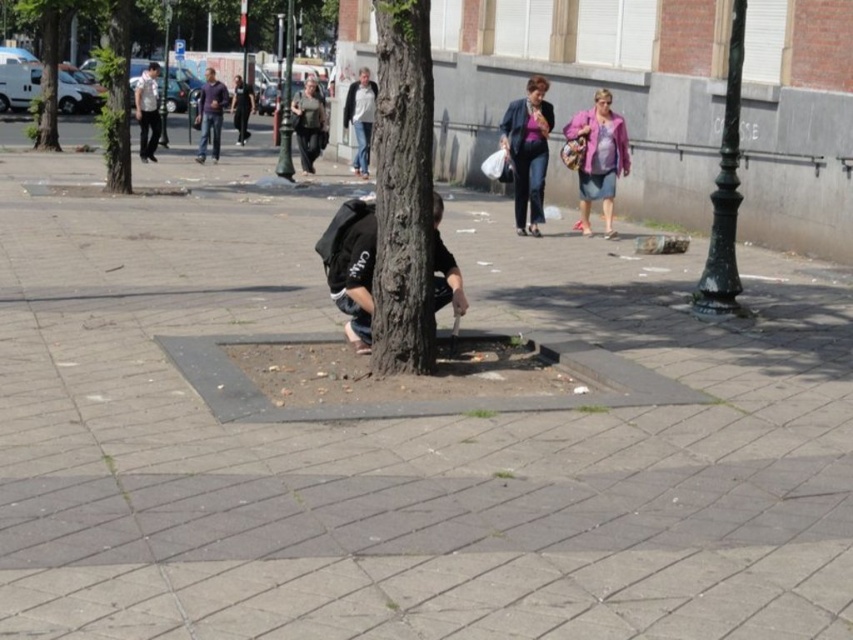
You are a city planner reviewing this public square layout. You notice the dark brown textured tree trunk at center and the dark gray jacket at upper left. Which object occupies more space in the image?

The dark gray jacket at upper left occupies more space in the image because the dark brown textured tree trunk at center is smaller than the dark gray jacket at upper left.

You are a city planner assessing the public square. You need to determine if the dark brown textured tree trunk at center will block the view of the dark gray jacket at upper left for someone standing at the base of the tree. Based on their heights, what do you conclude?

The dark brown textured tree trunk at center is not as tall as the dark gray jacket at upper left, so the tree trunk will not block the view of the jacket since it is shorter.